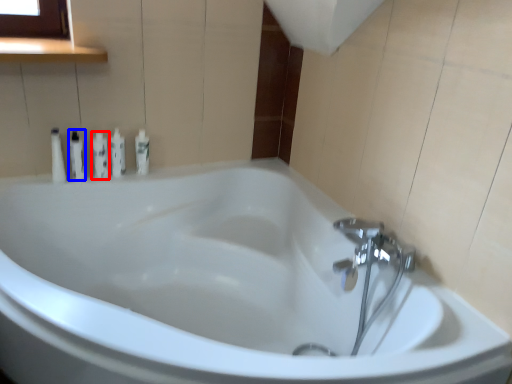
Question: Which object appears closest to the camera in this image, toiletry (highlighted by a red box) or toiletry (highlighted by a blue box)?

Choices:
 (A) toiletry
 (B) toiletry

Answer: (B)